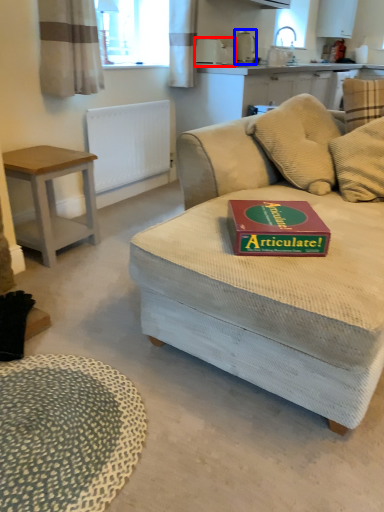
Question: Which of the following is the farthest to the observer, appliance (highlighted by a red box) or appliance (highlighted by a blue box)?

Choices:
 (A) appliance
 (B) appliance

Answer: (B)